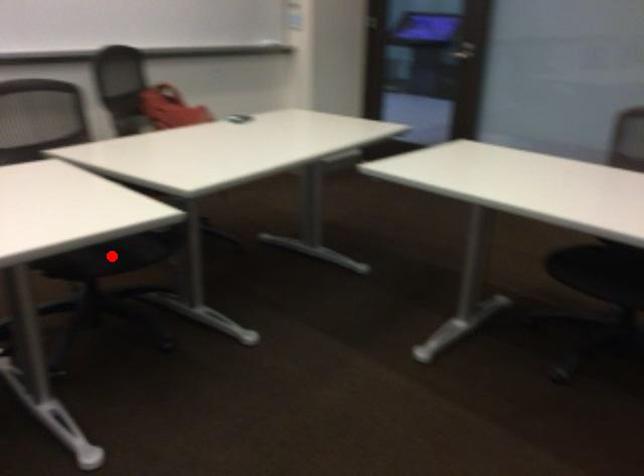
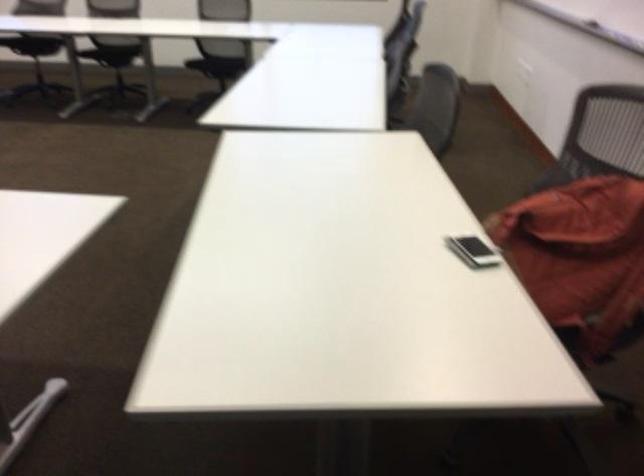
Question: I am providing you with two images of the same scene from different viewpoints. A red point is marked on the first image. Is the red point's position out of view in image 2?

Choices:
 (A) Yes
 (B) No

Answer: (A)